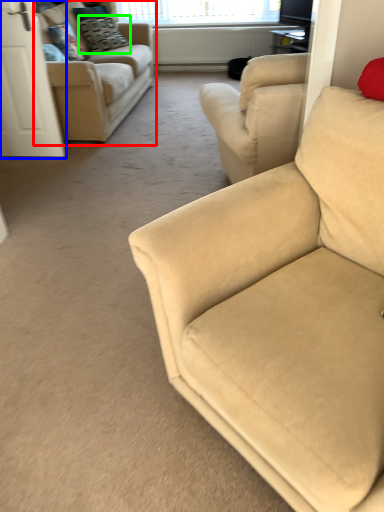
Question: Which is farther away from studio couch (highlighted by a red box)? screen door (highlighted by a blue box) or pillow (highlighted by a green box)?

Choices:
 (A) screen door
 (B) pillow

Answer: (B)